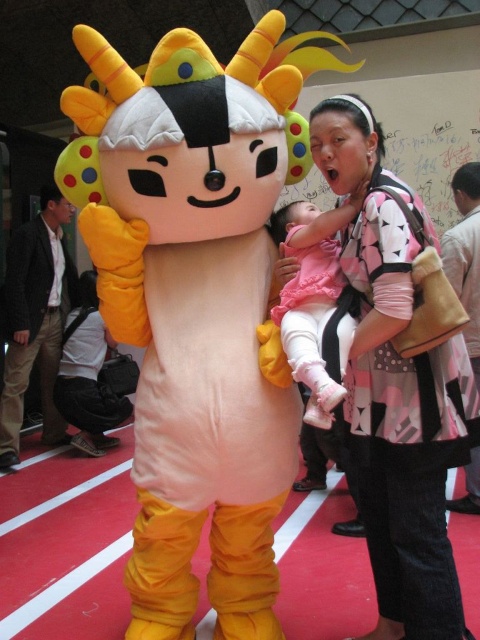
Based on the scene description, what is located at the coordinates point (397, 380)?

The matte pink dress at center is located at point (397, 380).

You are a photographer at the event and want to capture both the matte pink dress at center and the matte pink fabric baby at center in a single photo. Which object should be placed closer to the camera to ensure both are in focus?

The matte pink fabric baby at center should be placed closer to the camera because the matte pink dress at center is positioned under it, so adjusting the baby forward will keep both in focus.